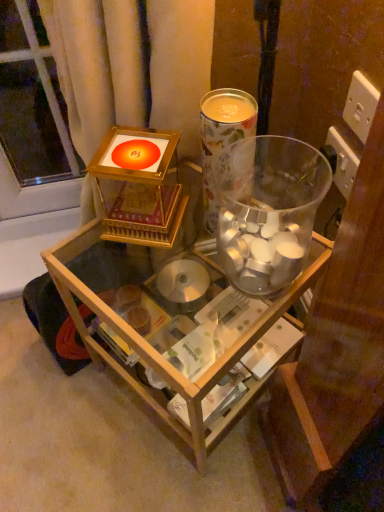
Question: Does transparent glass table at center have a larger size compared to transparent glass vase at center, the 2th beverage from the top?

Choices:
 (A) yes
 (B) no

Answer: (A)

Question: Is transparent glass table at center outside transparent glass vase at center, the 2th beverage from the top?

Choices:
 (A) yes
 (B) no

Answer: (A)

Question: Does transparent glass table at center have a greater height compared to transparent glass vase at center, the 2th beverage from the top?

Choices:
 (A) yes
 (B) no

Answer: (A)

Question: Is the position of transparent glass table at center more distant than that of transparent glass vase at center, the 2th beverage from the top?

Choices:
 (A) yes
 (B) no

Answer: (A)

Question: Considering the relative positions of transparent glass table at center and transparent glass vase at center, the first beverage positioned from the bottom, in the image provided, is transparent glass table at center to the left of transparent glass vase at center, the first beverage positioned from the bottom, from the viewer's perspective?

Choices:
 (A) yes
 (B) no

Answer: (A)

Question: From the image's perspective, is transparent glass table at center beneath transparent glass vase at center, the 2th beverage from the top?

Choices:
 (A) no
 (B) yes

Answer: (B)

Question: Is the position of transparent glass vase at center, the 2th beverage from the top, more distant than that of transparent glass table at center?

Choices:
 (A) no
 (B) yes

Answer: (A)

Question: Does transparent glass vase at center, the first beverage positioned from the bottom, lie in front of transparent glass table at center?

Choices:
 (A) yes
 (B) no

Answer: (A)

Question: Is transparent glass vase at center, the first beverage positioned from the bottom, to the right of transparent glass table at center from the viewer's perspective?

Choices:
 (A) no
 (B) yes

Answer: (B)

Question: From a real-world perspective, is transparent glass vase at center, the 2th beverage from the top, physically below transparent glass table at center?

Choices:
 (A) yes
 (B) no

Answer: (B)

Question: Does transparent glass vase at center, the 2th beverage from the top, have a greater height compared to transparent glass table at center?

Choices:
 (A) yes
 (B) no

Answer: (B)

Question: Is transparent glass vase at center, the first beverage positioned from the bottom, aimed at transparent glass table at center?

Choices:
 (A) yes
 (B) no

Answer: (B)

Question: Does transparent glass table at center appear on the right side of floral paper cup at upper center, placed as the first beverage when sorted from top to bottom?

Choices:
 (A) yes
 (B) no

Answer: (B)